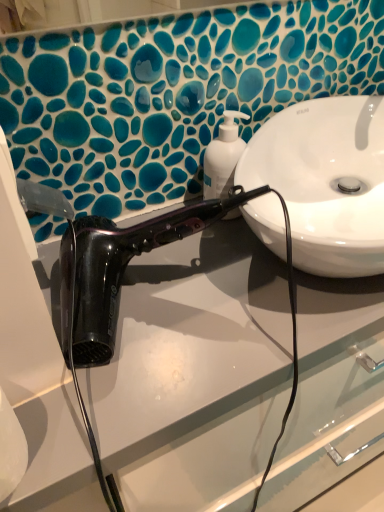
Question: Could white glossy soap dispenser at center be considered to be inside shiny black hair dryer at center?

Choices:
 (A) yes
 (B) no

Answer: (B)

Question: From a real-world perspective, is shiny black hair dryer at center on top of white glossy soap dispenser at center?

Choices:
 (A) yes
 (B) no

Answer: (B)

Question: Considering the relative positions of shiny black hair dryer at center and white glossy soap dispenser at center in the image provided, is shiny black hair dryer at center to the left of white glossy soap dispenser at center from the viewer's perspective?

Choices:
 (A) yes
 (B) no

Answer: (A)

Question: From the image's perspective, is shiny black hair dryer at center on white glossy soap dispenser at center?

Choices:
 (A) no
 (B) yes

Answer: (A)

Question: Is shiny black hair dryer at center bigger than white glossy soap dispenser at center?

Choices:
 (A) no
 (B) yes

Answer: (B)

Question: Can you confirm if shiny black hair dryer at center is shorter than white glossy soap dispenser at center?

Choices:
 (A) no
 (B) yes

Answer: (A)

Question: Can you confirm if white glossy soap dispenser at center is shorter than shiny black hair dryer at center?

Choices:
 (A) yes
 (B) no

Answer: (A)

Question: Does white glossy soap dispenser at center appear on the left side of shiny black hair dryer at center?

Choices:
 (A) no
 (B) yes

Answer: (A)

Question: Is white glossy soap dispenser at center bigger than shiny black hair dryer at center?

Choices:
 (A) yes
 (B) no

Answer: (B)

Question: Could you tell me if white glossy soap dispenser at center is facing shiny black hair dryer at center?

Choices:
 (A) no
 (B) yes

Answer: (A)

Question: Is white glossy soap dispenser at center taller than shiny black hair dryer at center?

Choices:
 (A) yes
 (B) no

Answer: (B)

Question: Is white glossy soap dispenser at center outside of shiny black hair dryer at center?

Choices:
 (A) no
 (B) yes

Answer: (B)

Question: From the image's perspective, is white glossy soap dispenser at center positioned above or below shiny black hair dryer at center?

Choices:
 (A) above
 (B) below

Answer: (A)